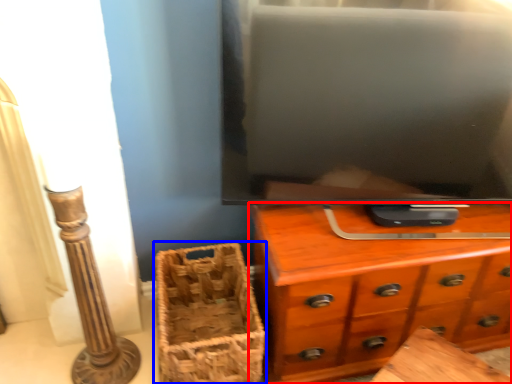
Question: Which object is closer to the camera taking this photo, chest of drawers (highlighted by a red box) or basket (highlighted by a blue box)?

Choices:
 (A) chest of drawers
 (B) basket

Answer: (A)